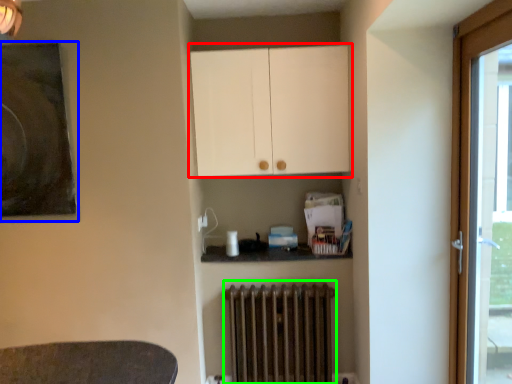
Question: Considering the real-world distances, which object is farthest from cabinetry (highlighted by a red box)? picture frame (highlighted by a blue box) or radiator (highlighted by a green box)?

Choices:
 (A) picture frame
 (B) radiator

Answer: (A)